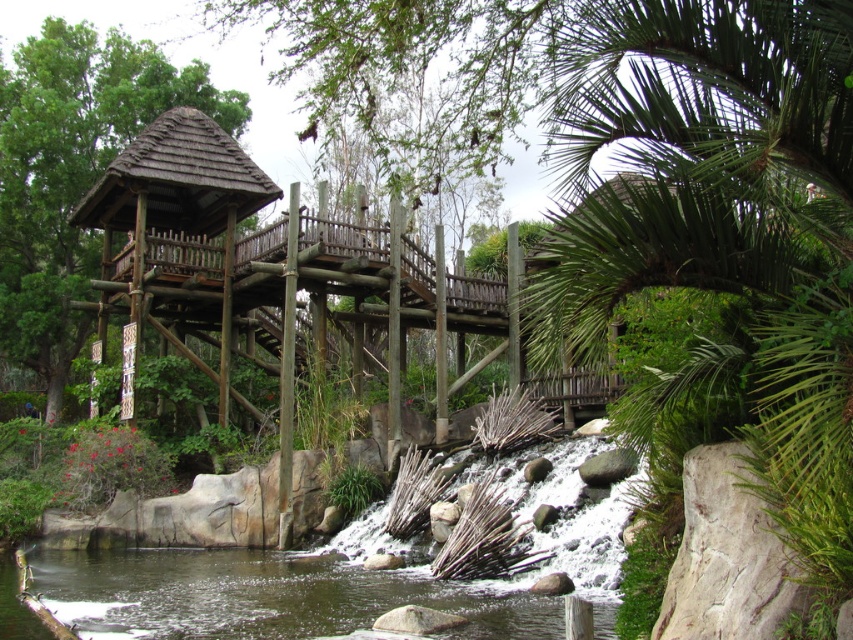
Question: Which is nearer to the wooden thatched roof gazebo at left?

Choices:
 (A) brown wooden gazebo at upper left
 (B) greenish-brown water at lower center

Answer: (A)

Question: Is greenish-brown water at lower center to the left of wooden thatched roof gazebo at left from the viewer's perspective?

Choices:
 (A) no
 (B) yes

Answer: (A)

Question: Does brown wooden gazebo at upper left appear on the right side of greenish-brown water at lower center?

Choices:
 (A) no
 (B) yes

Answer: (A)

Question: Can you confirm if greenish-brown water at lower center is positioned below wooden thatched roof gazebo at left?

Choices:
 (A) yes
 (B) no

Answer: (A)

Question: Which object is closer to the camera taking this photo?

Choices:
 (A) greenish-brown water at lower center
 (B) brown wooden gazebo at upper left
 (C) wooden thatched roof gazebo at left

Answer: (A)

Question: Estimate the real-world distances between objects in this image. Which object is farther from the wooden thatched roof gazebo at left?

Choices:
 (A) brown wooden gazebo at upper left
 (B) greenish-brown water at lower center

Answer: (B)